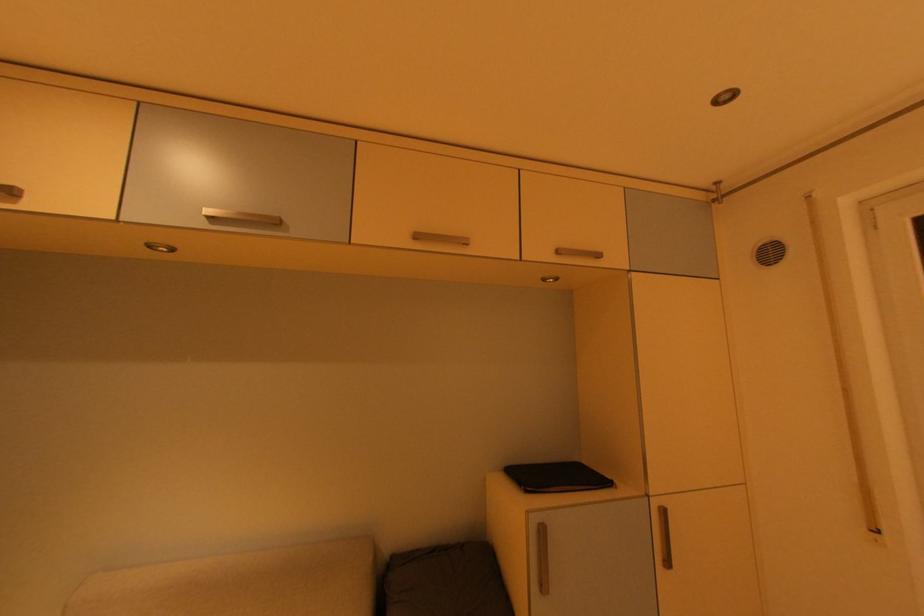
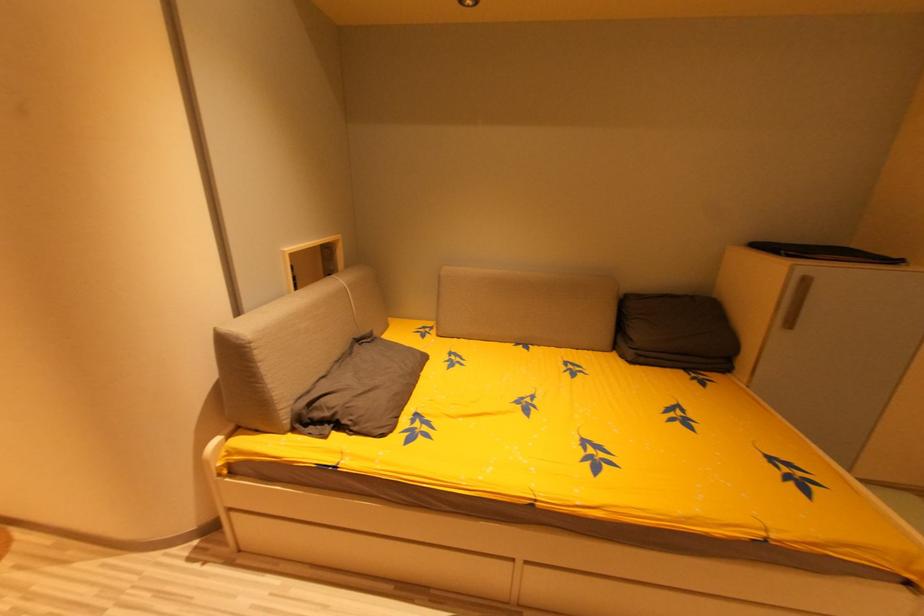
First-person continuous shooting, in which direction is the camera rotating?

The camera rotated toward left-down.